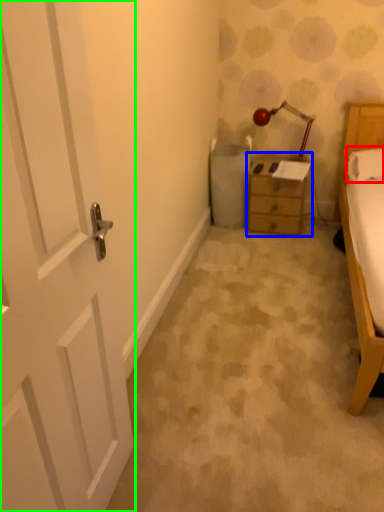
Question: Which object is positioned closest to pillow (highlighted by a red box)? Select from nightstand (highlighted by a blue box) and door (highlighted by a green box).

Choices:
 (A) nightstand
 (B) door

Answer: (A)